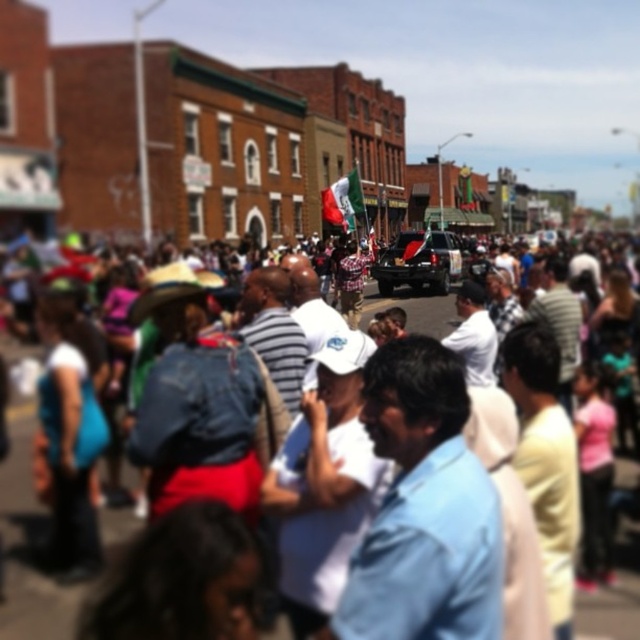
You are standing at the point with coordinates (28, 541) in the image. What object is located at that point?

The point at (28, 541) corresponds to the red flag at center.

You are a photographer standing in the crowd. You want to capture a photo that includes both the red flag at center and the shiny black suv at center. Based on their positions, which object should you focus on first to ensure both are in the frame?

The red flag at center might be wider than shiny black suv at center, so you should focus on the red flag at center first to ensure both are in the frame.